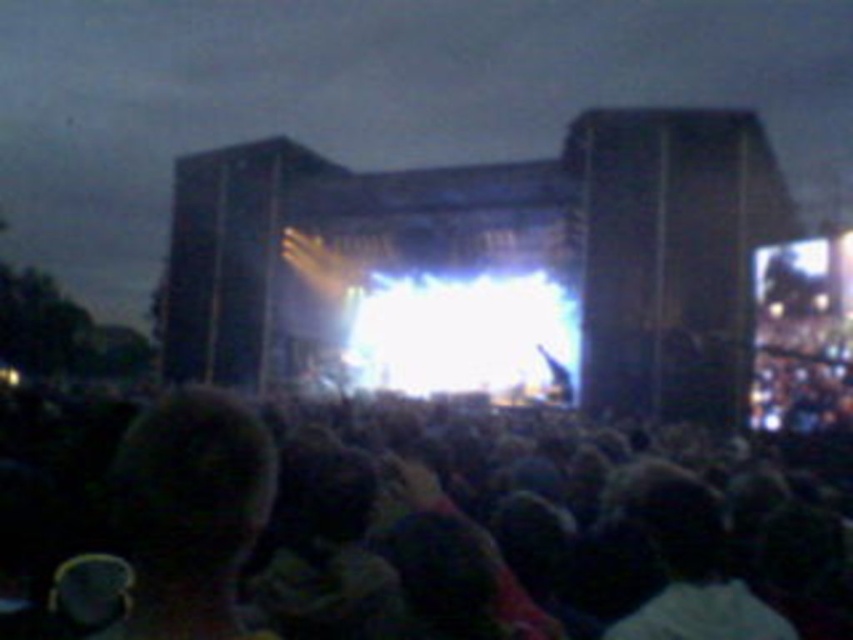
Question: From the image, what is the correct spatial relationship of dark matte crowd at center in relation to dark hair at lower left?

Choices:
 (A) above
 (B) below

Answer: (B)

Question: Which point appears closest to the camera in this image?

Choices:
 (A) (163, 586)
 (B) (798, 618)

Answer: (A)

Question: Among these points, which one is nearest to the camera?

Choices:
 (A) (543, 566)
 (B) (132, 632)

Answer: (B)

Question: Which point is farther from the camera taking this photo?

Choices:
 (A) (221, 403)
 (B) (207, 531)

Answer: (A)

Question: Where is dark matte crowd at center located in relation to dark hair at lower left in the image?

Choices:
 (A) below
 (B) above

Answer: (A)

Question: Does dark matte crowd at center have a larger size compared to dark hair at lower left?

Choices:
 (A) yes
 (B) no

Answer: (A)